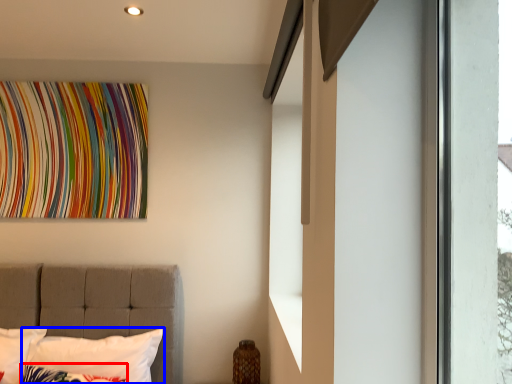
Question: Which point is closer to the camera, pillow (highlighted by a red box) or pillow (highlighted by a blue box)?

Choices:
 (A) pillow
 (B) pillow

Answer: (A)